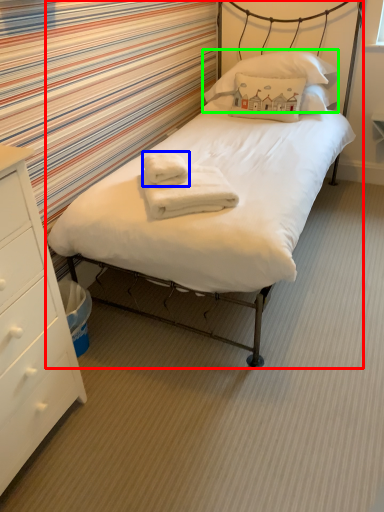
Question: Which object is the closest to the bed (highlighted by a red box)? Choose among these: bath towel (highlighted by a blue box) or pillow (highlighted by a green box).

Choices:
 (A) bath towel
 (B) pillow

Answer: (A)